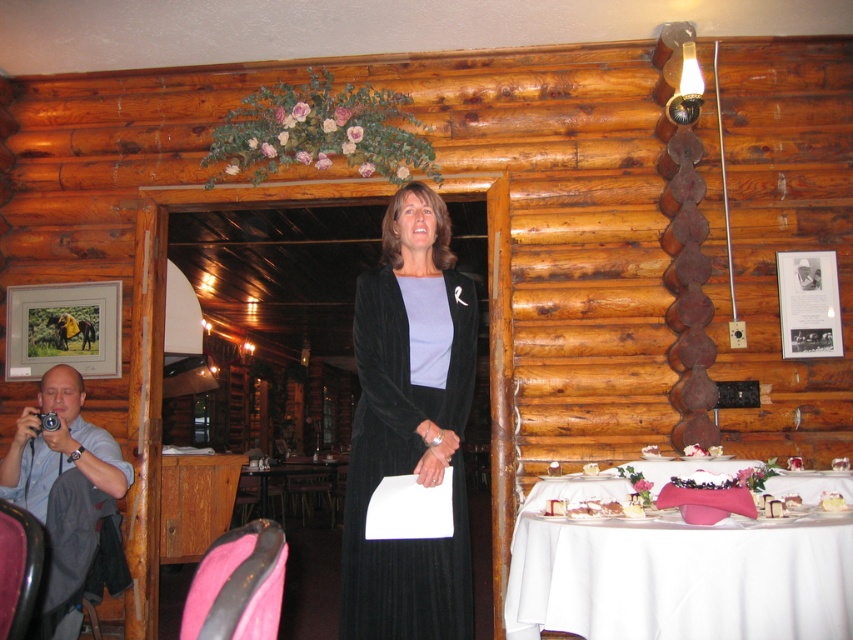
In the scene shown: Who is more distant from viewer, (737, 593) or (39, 472)?

Point (39, 472)

Does point (786, 532) come farther from viewer compared to point (33, 500)?

No, it is in front of (33, 500).

Does point (619, 552) come in front of point (62, 390)?

Yes, it is.

I want to click on white cloth table at lower right, so [x=674, y=572].

Is black velvet dress at center to the left of blue shirt at left from the viewer's perspective?

In fact, black velvet dress at center is to the right of blue shirt at left.

Which is behind, point (422, 554) or point (111, 477)?

The point (111, 477) is behind.

Find the location of a particular element. This screenshot has height=640, width=853. black velvet dress at center is located at coordinates (390, 474).

Can you confirm if white cloth table at lower right is bigger than black velvet dress at center?

Correct, white cloth table at lower right is larger in size than black velvet dress at center.

Does white cloth table at lower right appear on the right side of black velvet dress at center?

Yes, white cloth table at lower right is to the right of black velvet dress at center.

Is point (834, 556) farther from camera compared to point (364, 392)?

That is False.

Identify the location of white cloth table at lower right. (674, 572).